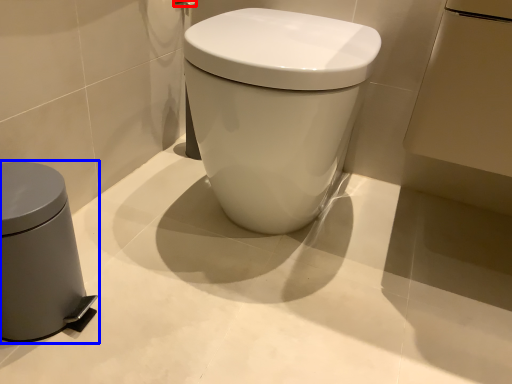
Question: Which point is further to the camera, towel bar (highlighted by a red box) or waste container (highlighted by a blue box)?

Choices:
 (A) towel bar
 (B) waste container

Answer: (A)